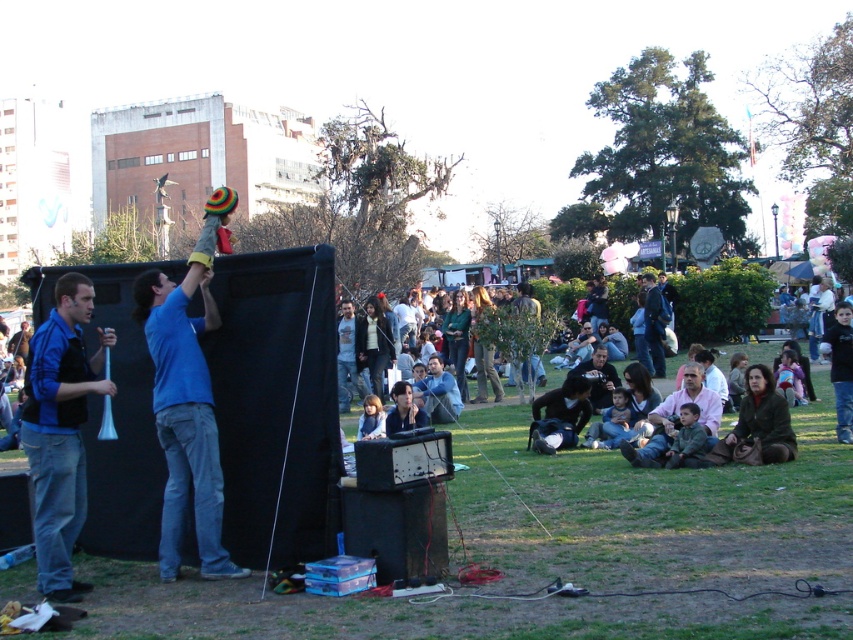
You are at the park and see a blue fabric hat at upper left. Can you tell me where exactly the point at coordinates (x=187, y=400) is located on the blue fabric hat at upper left?

The point at coordinates (x=187, y=400) is located on the blue fabric hat at upper left.

You are a photographer trying to capture a clear shot of both the blue fabric hat at upper left and the blue fabric megaphone at left. Since you want to ensure both are visible in your frame, which object should you focus on first to account for their sizes?

The blue fabric hat at upper left is taller than the blue fabric megaphone at left, so you should focus on the blue fabric hat at upper left first to ensure its full height is captured in the frame.

You are at the park and want to see the blue fabric hat at upper left and the blue fabric megaphone at left clearly. Which object is blocking your view of the other?

The blue fabric hat at upper left is positioned over the blue fabric megaphone at left, so the hat is blocking the view of the megaphone.